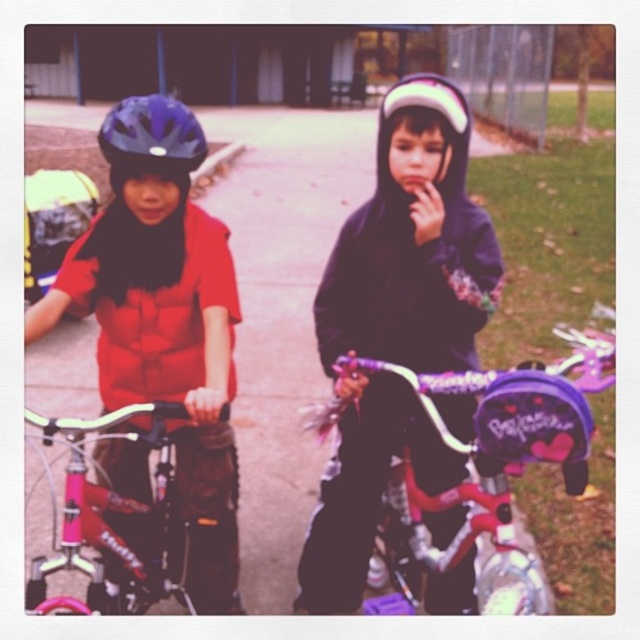
You are a photographer trying to capture a closeup of the matte black hoodie at center. Given that your camera has a focus range of 0.5 meters to 1.5 meters, and the hoodie is positioned at coordinates point 0.508, 0.620, can you confirm if the hoodie is within the focus range?

The matte black hoodie at center is located at point (x=396, y=324), which falls within the camera focus range of 0.5 to 1.5 meters. Therefore, the hoodie is within the focus range and can be captured clearly.

You are a bicycle shop assistant. A customer asks which helmet is bigger between the matte black helmet at left and the matte black helmet at upper left. Based on the image, which one is bigger?

The matte black helmet at left is larger in size than the matte black helmet at upper left, so the matte black helmet at left is bigger.

Based on the photo, you are standing in front of the image and want to know how far the point at coordinates (193, 148) is from you. Can you determine the distance?

The point at coordinates (193, 148) is 5.73 feet away from the viewer.